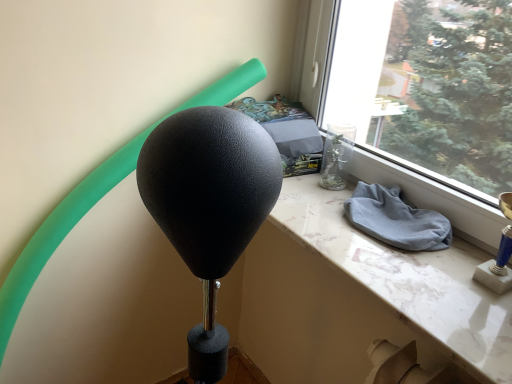
This screenshot has width=512, height=384. Identify the location of free space to the left of gray cotton cloth at window sill. (318, 219).